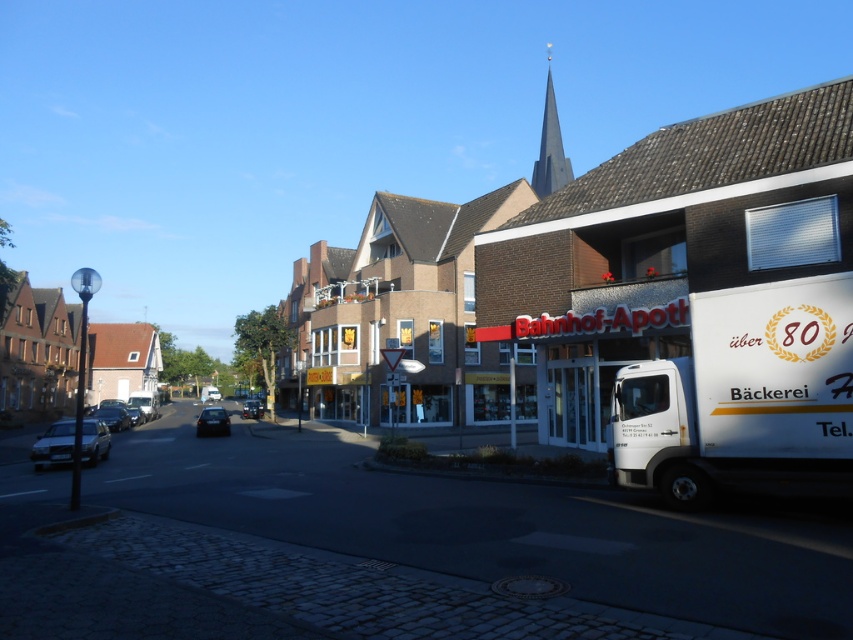
Is silver metallic car at lower left closer to the viewer compared to dark gray metallic car at center?

Yes, silver metallic car at lower left is in front of dark gray metallic car at center.

Is point (71, 445) farther from camera compared to point (248, 413)?

No, (71, 445) is closer to viewer.

You are a GUI agent. You are given a task and a screenshot of the screen. Output one action in this format:
    pyautogui.click(x=<x>, y=<y>)
    Task: Click on the silver metallic car at lower left
    
    Given the screenshot: What is the action you would take?
    pyautogui.click(x=53, y=445)

Is shiny black car at center further to the viewer compared to shiny black car at left?

No, it is not.

Looking at this image, between shiny black car at center and shiny black car at left, which one has more height?

With more height is shiny black car at left.

Who is more distant from viewer, (198, 433) or (137, 406)?

Positioned behind is point (137, 406).

Where is `shiny black car at center`? The height and width of the screenshot is (640, 853). shiny black car at center is located at coordinates (212, 420).

Is point (828, 308) closer to viewer compared to point (567, 179)?

That is True.

What do you see at coordinates (743, 396) in the screenshot? I see `white matte truck at right` at bounding box center [743, 396].

Is point (802, 289) farther from camera compared to point (543, 152)?

No, it is not.

Identify the location of white matte truck at right. This screenshot has width=853, height=640. (743, 396).